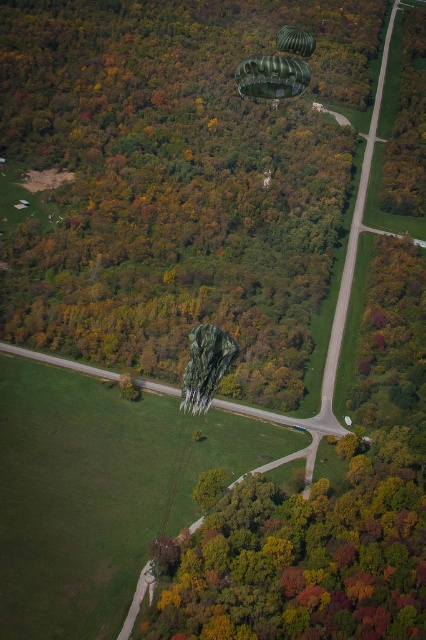
Question: Can you confirm if green matte parachute at center is thinner than green fabric parachute at upper center?

Choices:
 (A) yes
 (B) no

Answer: (A)

Question: Can you confirm if green matte parachute at center is smaller than green fabric parachute at upper center?

Choices:
 (A) no
 (B) yes

Answer: (B)

Question: Which object is the closest to the green matte balloon at upper center?

Choices:
 (A) green matte parachute at center
 (B) green fabric parachute at upper center

Answer: (B)

Question: Can you confirm if green matte parachute at center is positioned to the right of green fabric parachute at upper center?

Choices:
 (A) no
 (B) yes

Answer: (A)

Question: Among these objects, which one is farthest from the camera?

Choices:
 (A) green fabric parachute at upper center
 (B) green matte balloon at upper center

Answer: (A)

Question: Estimate the real-world distances between objects in this image. Which object is closer to the green fabric parachute at upper center?

Choices:
 (A) green matte balloon at upper center
 (B) green matte parachute at center

Answer: (A)